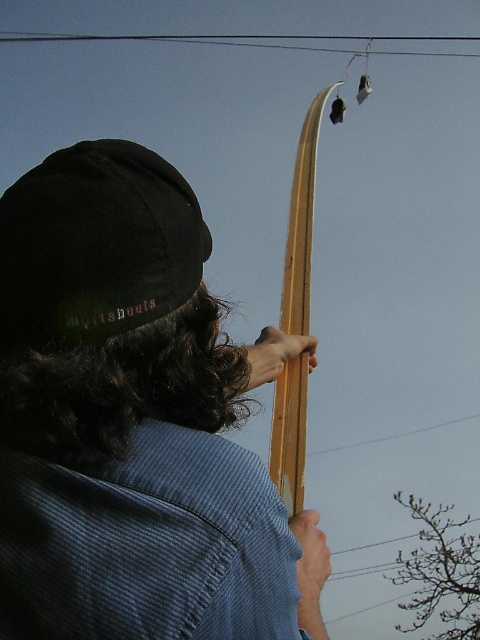
You are an archer who needs to aim at a target located above the power lines. Based on the scene, can you determine if the wooden bow at upper center is tall enough to reach above the black wire at upper center for the shot?

The wooden bow at upper center is much taller than the black wire at upper center, so yes, the archer can aim and shoot over the black wire at upper center using the wooden bow at upper center.

You are an archer who needs to retrieve your wooden bow at upper center. Given that you are standing at the bottom of the image, which direction should you look to find it?

The wooden bow at upper center is located at point 0.659 on the x axis and 0.279 on the y axis, so you should look upward and slightly to the right to find it.